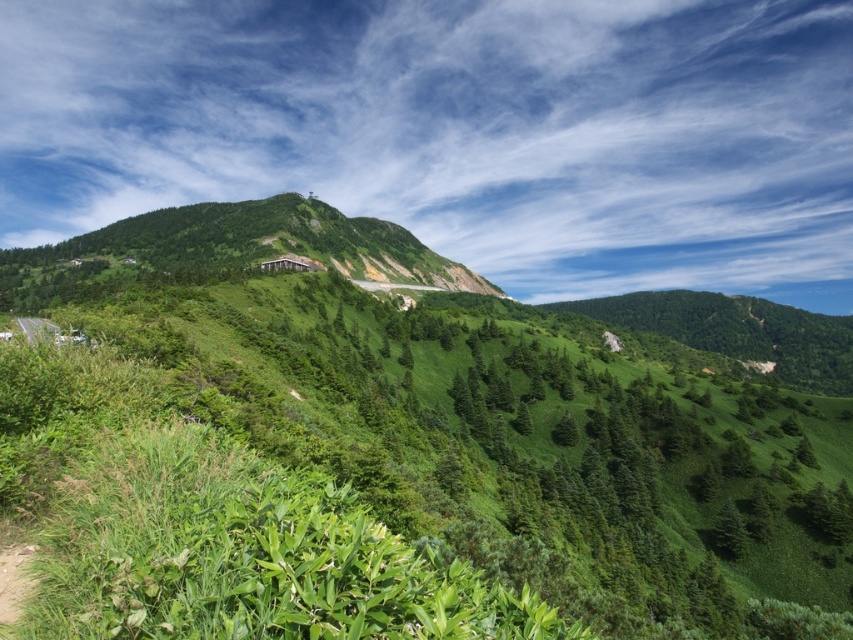
Does green leafy shrubs at center come behind green grassy hill at center?

No, it is in front of green grassy hill at center.

I want to click on green leafy shrubs at center, so click(x=485, y=442).